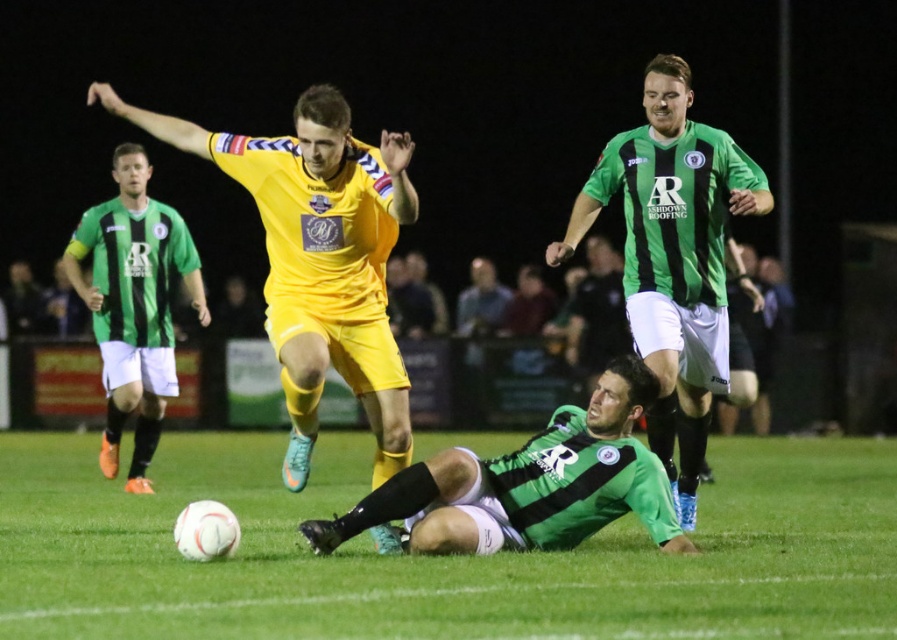
Between green grass at center and green striped jersey at left, which one has more height?

green striped jersey at left is taller.

Does green grass at center have a greater height compared to green striped jersey at left?

In fact, green grass at center may be shorter than green striped jersey at left.

Identify the location of green grass at center. The image size is (897, 640). pos(441,556).

This screenshot has height=640, width=897. What are the coordinates of `green grass at center` in the screenshot? It's located at (441, 556).

Can you confirm if green grass at center is taller than green striped jersey at upper right?

No.

Looking at this image, does green grass at center have a lesser height compared to green striped jersey at upper right?

Correct, green grass at center is not as tall as green striped jersey at upper right.

This screenshot has height=640, width=897. What do you see at coordinates (441, 556) in the screenshot?
I see `green grass at center` at bounding box center [441, 556].

Where is `green grass at center`? The height and width of the screenshot is (640, 897). green grass at center is located at coordinates (441, 556).

Based on the photo, between green striped jersey at upper right and green matte jersey at center, which one has more height?

green striped jersey at upper right is taller.

Does green striped jersey at upper right have a greater width compared to green matte jersey at center?

In fact, green striped jersey at upper right might be narrower than green matte jersey at center.

Does point (669, 58) come behind point (629, 416)?

Yes.

Locate an element on the screen. This screenshot has width=897, height=640. green striped jersey at upper right is located at coordinates (673, 257).